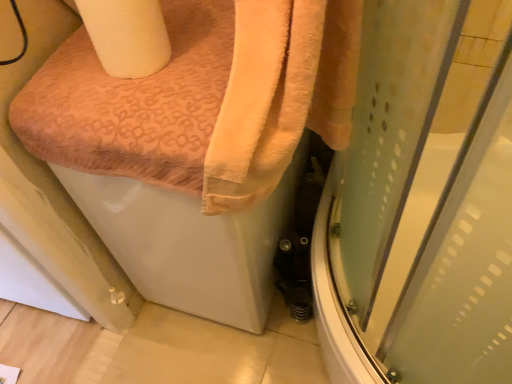
Question: From the image's perspective, does orange textured towel at upper left appear higher than transparent plastic screen door at lower right?

Choices:
 (A) yes
 (B) no

Answer: (B)

Question: Is the depth of orange textured towel at upper left greater than that of transparent plastic screen door at lower right?

Choices:
 (A) no
 (B) yes

Answer: (B)

Question: Does orange textured towel at upper left have a smaller size compared to transparent plastic screen door at lower right?

Choices:
 (A) yes
 (B) no

Answer: (B)

Question: Is orange textured towel at upper left located outside transparent plastic screen door at lower right?

Choices:
 (A) yes
 (B) no

Answer: (A)

Question: Can you confirm if orange textured towel at upper left is bigger than transparent plastic screen door at lower right?

Choices:
 (A) no
 (B) yes

Answer: (B)

Question: Is white matte toilet paper at upper left bigger or smaller than orange textured towel at upper left?

Choices:
 (A) small
 (B) big

Answer: (A)

Question: Looking at their shapes, would you say white matte toilet paper at upper left is wider or thinner than orange textured towel at upper left?

Choices:
 (A) thin
 (B) wide

Answer: (A)

Question: From their relative heights in the image, would you say white matte toilet paper at upper left is taller or shorter than orange textured towel at upper left?

Choices:
 (A) short
 (B) tall

Answer: (A)

Question: From the image's perspective, is white matte toilet paper at upper left located above or below orange textured towel at upper left?

Choices:
 (A) above
 (B) below

Answer: (A)

Question: Considering the positions of orange textured towel at upper left and transparent plastic screen door at lower right in the image, is orange textured towel at upper left taller or shorter than transparent plastic screen door at lower right?

Choices:
 (A) short
 (B) tall

Answer: (B)

Question: Considering the positions of orange textured towel at upper left and transparent plastic screen door at lower right in the image, is orange textured towel at upper left wider or thinner than transparent plastic screen door at lower right?

Choices:
 (A) thin
 (B) wide

Answer: (B)

Question: Is orange textured towel at upper left to the left or to the right of transparent plastic screen door at lower right in the image?

Choices:
 (A) left
 (B) right

Answer: (A)

Question: From the image's perspective, is orange textured towel at upper left located above or below transparent plastic screen door at lower right?

Choices:
 (A) above
 (B) below

Answer: (B)

Question: Based on their sizes in the image, would you say orange soft towel at upper left is bigger or smaller than orange textured towel at upper left?

Choices:
 (A) small
 (B) big

Answer: (A)

Question: From a real-world perspective, relative to orange textured towel at upper left, is orange soft towel at upper left vertically above or below?

Choices:
 (A) below
 (B) above

Answer: (B)